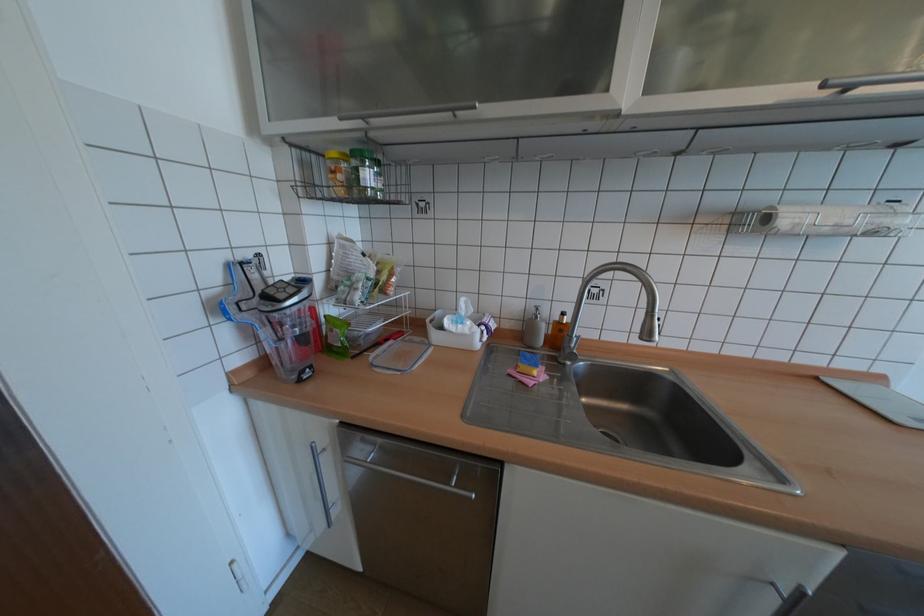
Where would you open the silver faucet lever? Please return your answer as a coordinate pair (x, y).

(568, 349)